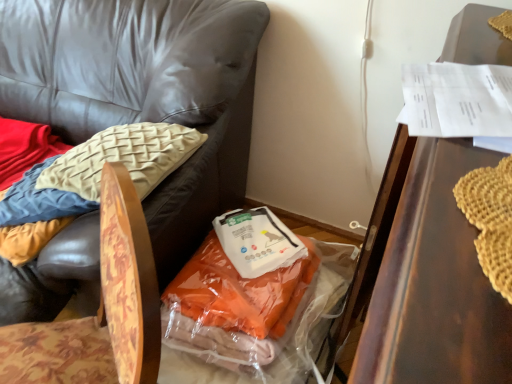
Question: In terms of height, does translucent plastic bag at center look taller or shorter compared to floral fabric chair at lower left, the second chair positioned from the left?

Choices:
 (A) tall
 (B) short

Answer: (B)

Question: Is translucent plastic bag at center in front of or behind floral fabric chair at lower left, which is counted as the 1th chair, starting from the right, in the image?

Choices:
 (A) behind
 (B) front

Answer: (A)

Question: Based on their relative distances, which object is nearer to the floral fabric chair at lower left, the second chair positioned from the left?

Choices:
 (A) translucent plastic bag at center
 (B) wooden textured chair at lower left, positioned as the 2th chair in right-to-left order
 (C) translucent plastic bag at center

Answer: (C)

Question: Which object is positioned farthest from the wooden textured chair at lower left, positioned as the 2th chair in right-to-left order?

Choices:
 (A) translucent plastic bag at center
 (B) floral fabric chair at lower left, the second chair positioned from the left
 (C) translucent plastic bag at center

Answer: (B)